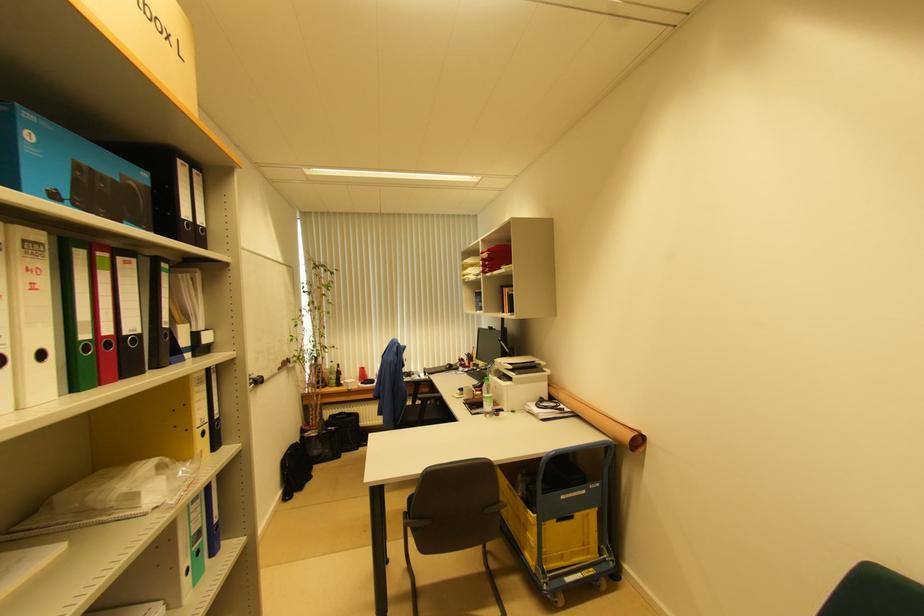
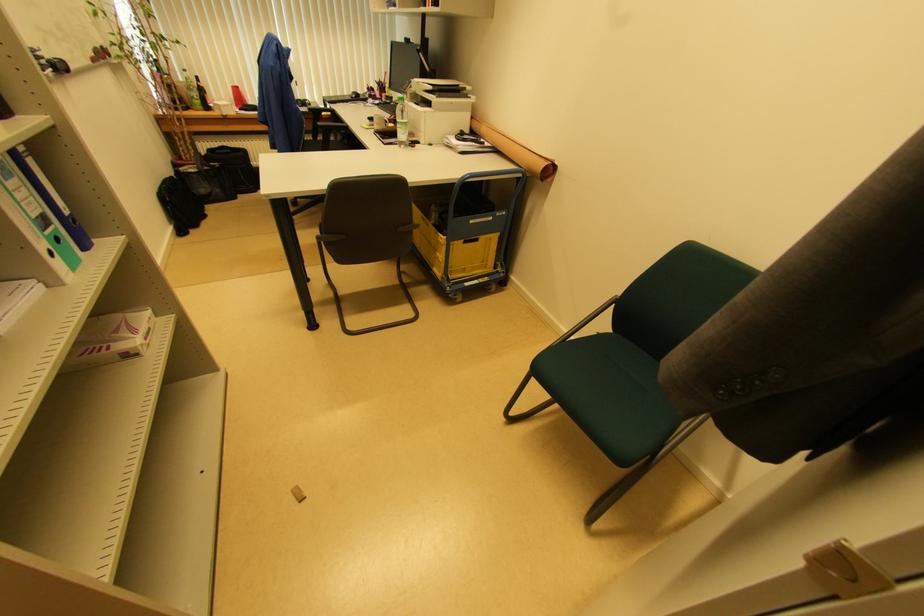
Locate, in the second image, the point that corresponds to point 485,405 in the first image.

(398, 132)